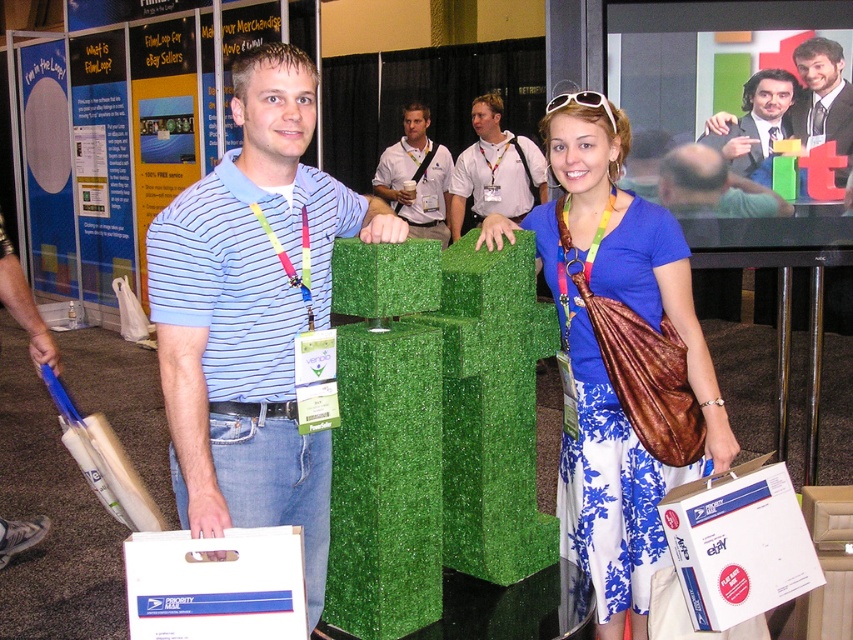
You are organizing an event and need to place a new decorative item between the white matte box at lower right and the light blue striped polo shirt at center. Which object should the new item be placed closer to if it needs to avoid being overshadowed by the larger object?

The new item should be placed closer to the white matte box at lower right because it is smaller than the light blue striped polo shirt at center, so placing it near the smaller object reduces the chance of it being overshadowed.